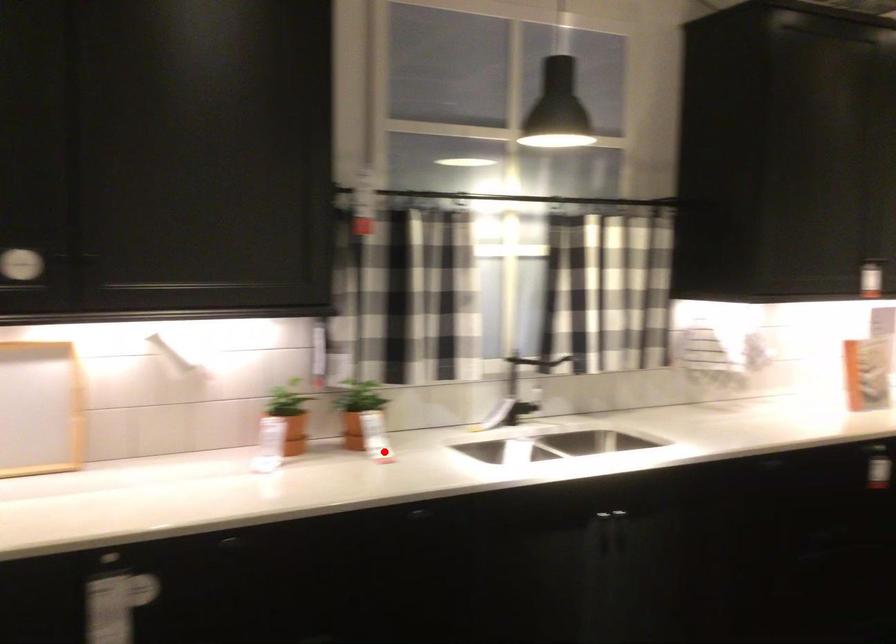
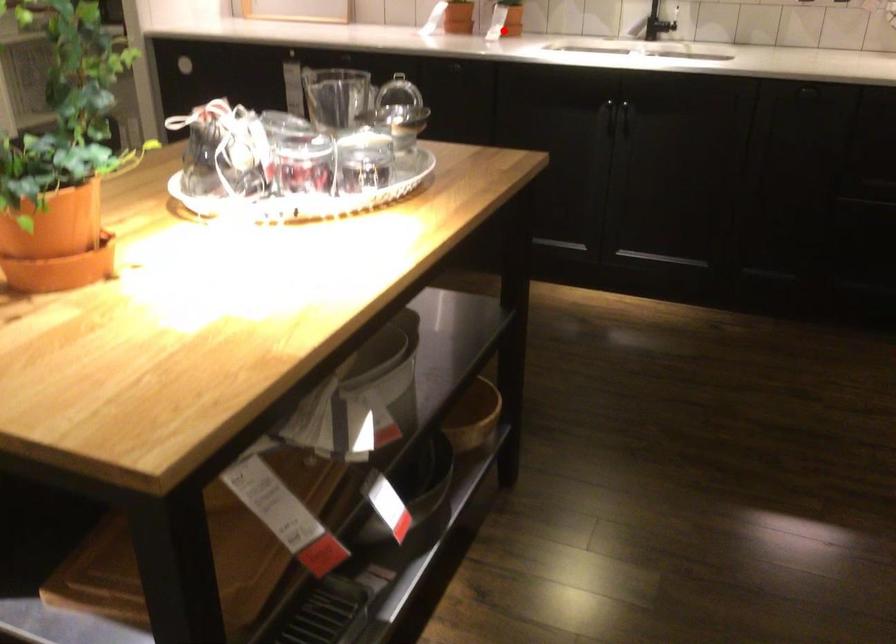
I am providing you with two images of the same scene from different viewpoints. A red point is marked on the first image and another point is marked on the second image. Is the red point in image1 aligned with the point shown in image2?

Yes